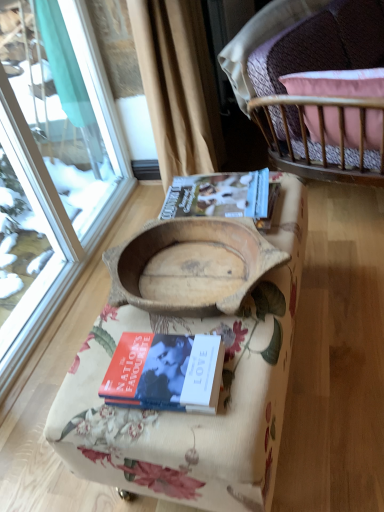
Question: Is point (233, 182) positioned closer to the camera than point (190, 348)?

Choices:
 (A) closer
 (B) farther

Answer: (B)

Question: Is matte brown book at center, arranged as the second book when ordered from the bottom, situated inside hardcover book at center, the first book in the front-to-back sequence, or outside?

Choices:
 (A) outside
 (B) inside

Answer: (A)

Question: Based on their relative distances, which object is nearer to the beige fabric curtain at upper center?

Choices:
 (A) matte brown book at center, which ranks as the 1th book in back-to-front order
 (B) hardcover book at center, which is the first book from bottom to top
 (C) wooden cradle at center
 (D) pink fabric cushion at upper right
 (E) wooden bowl at center

Answer: (D)

Question: Estimate the real-world distances between objects in this image. Which object is farther from the beige fabric curtain at upper center?

Choices:
 (A) matte brown book at center, acting as the first book starting from the top
 (B) pink fabric cushion at upper right
 (C) hardcover book at center, which is the first book from bottom to top
 (D) wooden bowl at center
 (E) wooden cradle at center

Answer: (C)